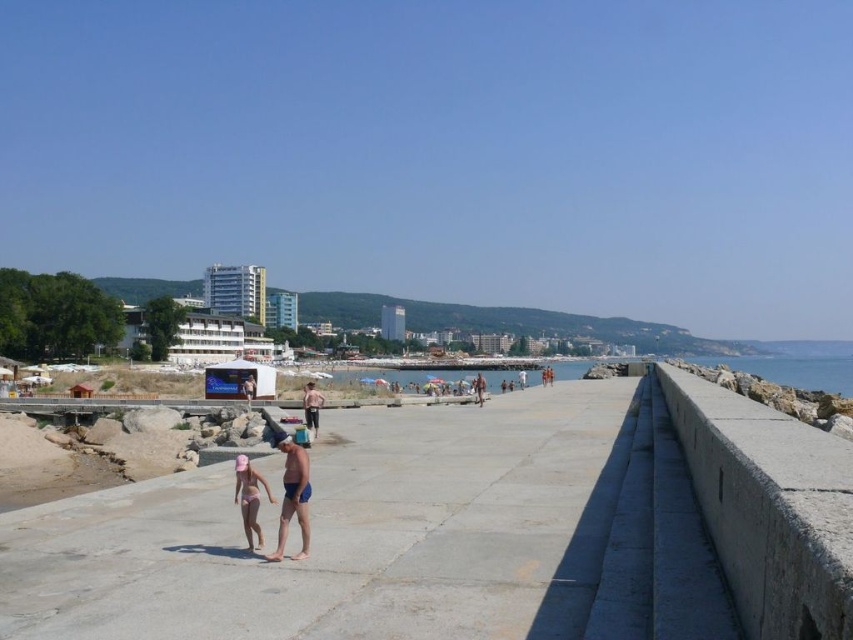
You are a photographer standing on the seaside promenade and want to capture a photo that includes both the blue water at right and the smooth tan skin at center. Given their distance apart, do you think you can fit both subjects into your camera frame without moving your position? The camera has a standard 50mm lens with a 46 degree angle of view.

The blue water at right and smooth tan skin at center are 725.45 feet apart. With a 50mm lens and 46 degree angle of view, the maximum horizontal coverage at your position would need to be calculated. However, at 725.45 feet apart, it is highly unlikely the standard lens can capture both subjects in one frame without moving. The distance exceeds typical angle coverage for such a lens.